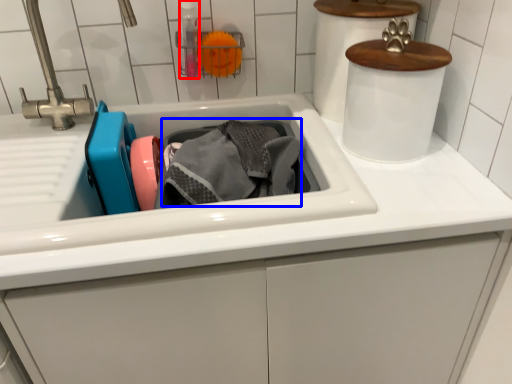
Question: Which object appears farthest to the camera in this image, bottle (highlighted by a red box) or material (highlighted by a blue box)?

Choices:
 (A) bottle
 (B) material

Answer: (A)